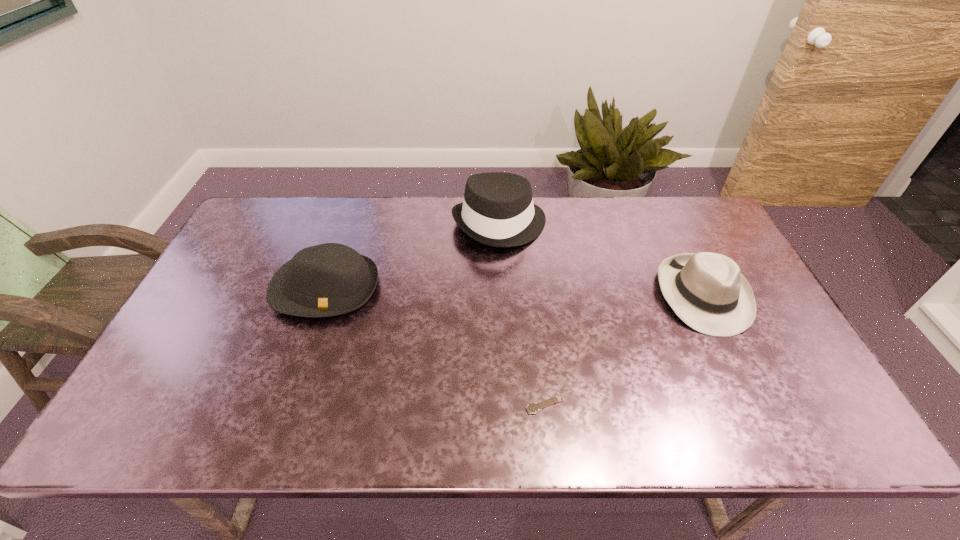
In order to click on vacant area that lies between the leftmost fedora and the tallest object in this screenshot , I will do `click(413, 256)`.

Where is `free space between the leftmost object and the rightmost object`? The width and height of the screenshot is (960, 540). free space between the leftmost object and the rightmost object is located at coordinates (515, 291).

The width and height of the screenshot is (960, 540). Find the location of `vacant space in between the leftmost fedora and the rightmost fedora`. vacant space in between the leftmost fedora and the rightmost fedora is located at coordinates (515, 291).

Identify the location of vacant space that's between the rightmost object and the watch. (624, 349).

This screenshot has height=540, width=960. Identify the location of vacant region between the watch and the leftmost object. coord(435,346).

Locate an element on the screen. The height and width of the screenshot is (540, 960). empty space between the leftmost object and the rightmost object is located at coordinates (515, 291).

Where is `free area in between the nearest object and the leftmost object`? free area in between the nearest object and the leftmost object is located at coordinates (435, 346).

Locate an element on the screen. Image resolution: width=960 pixels, height=540 pixels. empty space that is in between the leftmost object and the tallest fedora is located at coordinates (413, 256).

The image size is (960, 540). In order to click on free space between the leftmost object and the rightmost fedora in this screenshot , I will do `click(515, 291)`.

You are a GUI agent. You are given a task and a screenshot of the screen. Output one action in this format:
    pyautogui.click(x=<x>, y=<y>)
    Task: Click on the object that stands as the second closest to the rightmost object
    
    Given the screenshot: What is the action you would take?
    pyautogui.click(x=532, y=408)